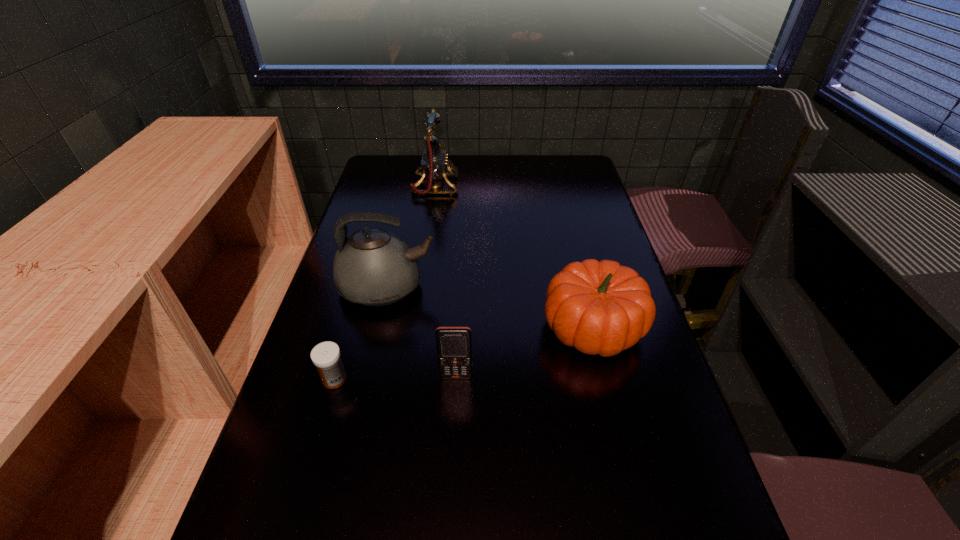
Where is `telephone`? This screenshot has width=960, height=540. telephone is located at coordinates (434, 161).

What are the coordinates of `kettle` in the screenshot? It's located at (373, 267).

The image size is (960, 540). I want to click on the rightmost object, so click(x=602, y=308).

What are the coordinates of `cellular telephone` in the screenshot? It's located at pyautogui.click(x=454, y=344).

At what (x,y) coordinates should I click in order to perform the action: click on medicine. Please return your answer as a coordinate pair (x, y). Looking at the image, I should click on (326, 356).

Identify the location of free point located on the front of the telephone, featuring the rotary dial. This screenshot has width=960, height=540. (519, 186).

What are the coordinates of `vacant space located 0.120m at the spout of the kettle` in the screenshot? It's located at (482, 287).

You are a GUI agent. You are given a task and a screenshot of the screen. Output one action in this format:
    pyautogui.click(x=<x>, y=<y>)
    Task: Click on the vacant space located 0.110m on the front of the rightmost object
    This screenshot has width=960, height=540.
    Given the screenshot: What is the action you would take?
    pyautogui.click(x=613, y=411)

The height and width of the screenshot is (540, 960). Find the location of `vacant space positioned 0.120m on the screen of the cellular telephone`. vacant space positioned 0.120m on the screen of the cellular telephone is located at coordinates (454, 430).

Find the location of a particular element. The width and height of the screenshot is (960, 540). vacant region located on the right of the medicine is located at coordinates (447, 379).